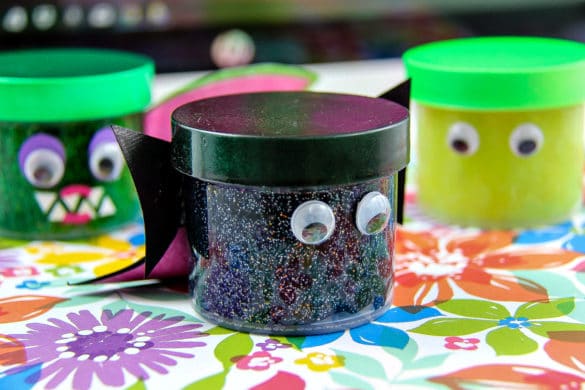
Image resolution: width=585 pixels, height=390 pixels. I want to click on plastic containers, so click(x=426, y=125), click(x=235, y=206), click(x=13, y=167).